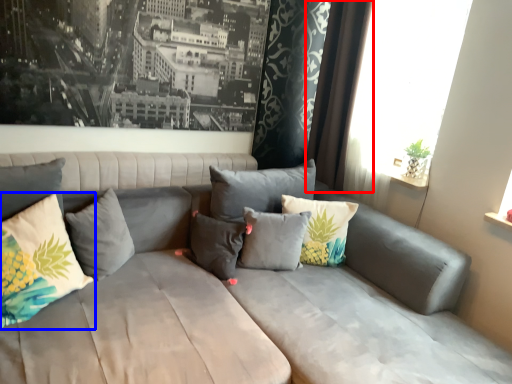
Question: Which of the following is the farthest to the observer, curtain (highlighted by a red box) or pillow (highlighted by a blue box)?

Choices:
 (A) curtain
 (B) pillow

Answer: (A)